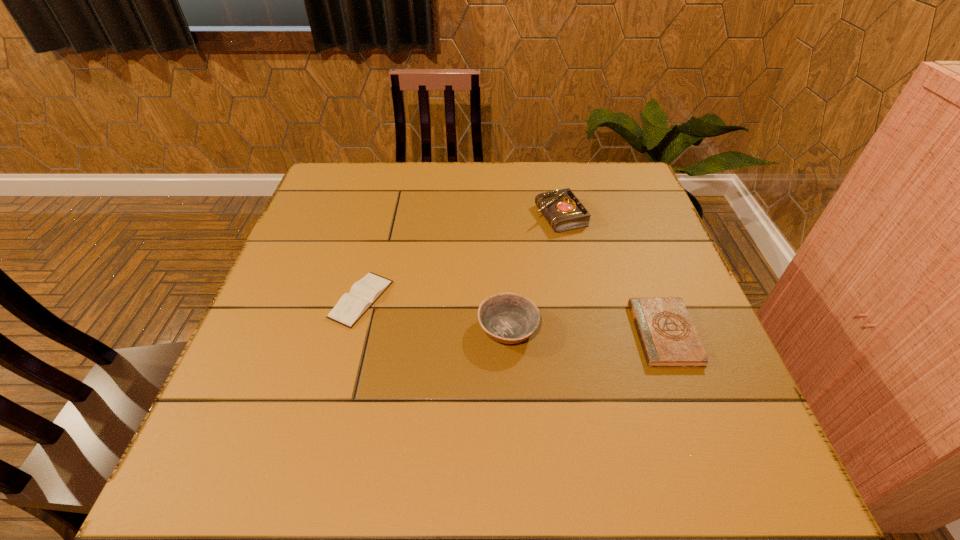
This screenshot has height=540, width=960. I want to click on vacant space located 0.290m on the back of the leftmost object, so click(x=386, y=202).

Locate an element on the screen. Image resolution: width=960 pixels, height=540 pixels. object at the far edge is located at coordinates (562, 209).

The height and width of the screenshot is (540, 960). I want to click on object present at the left edge, so click(x=351, y=306).

Identify the location of object that is at the right edge. (668, 337).

This screenshot has height=540, width=960. What are the coordinates of `vacant space at the far edge of the desktop` in the screenshot? It's located at (383, 165).

In the image, there is a desktop. At what (x,y) coordinates should I click in order to perform the action: click on free region at the near edge. Please return your answer as a coordinate pair (x, y). Image resolution: width=960 pixels, height=540 pixels. Looking at the image, I should click on click(x=592, y=465).

Find the location of a particular element. vacant space at the left edge is located at coordinates (339, 256).

Locate an element on the screen. This screenshot has height=540, width=960. vacant space at the right edge of the desktop is located at coordinates (684, 418).

Where is `vacant space at the far left corner`? This screenshot has height=540, width=960. vacant space at the far left corner is located at coordinates (333, 199).

Locate an element on the screen. vacant position at the far right corner of the desktop is located at coordinates (613, 176).